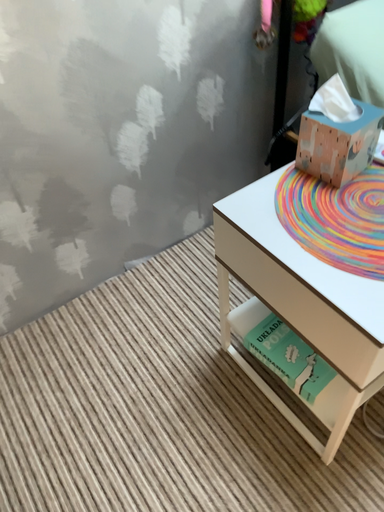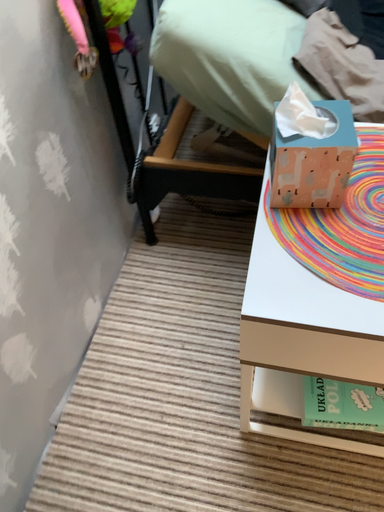
Question: How did the camera likely rotate when shooting the video?

Choices:
 (A) rotated downward
 (B) rotated upward

Answer: (B)